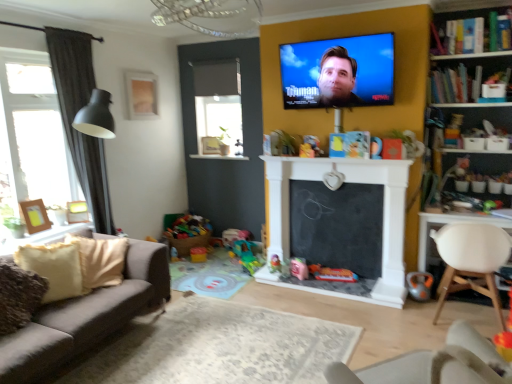
This screenshot has width=512, height=384. In order to click on vacant space to the left of plastic green toy at center, which appears as the 5th toy when viewed from the front in this screenshot , I will do `click(234, 271)`.